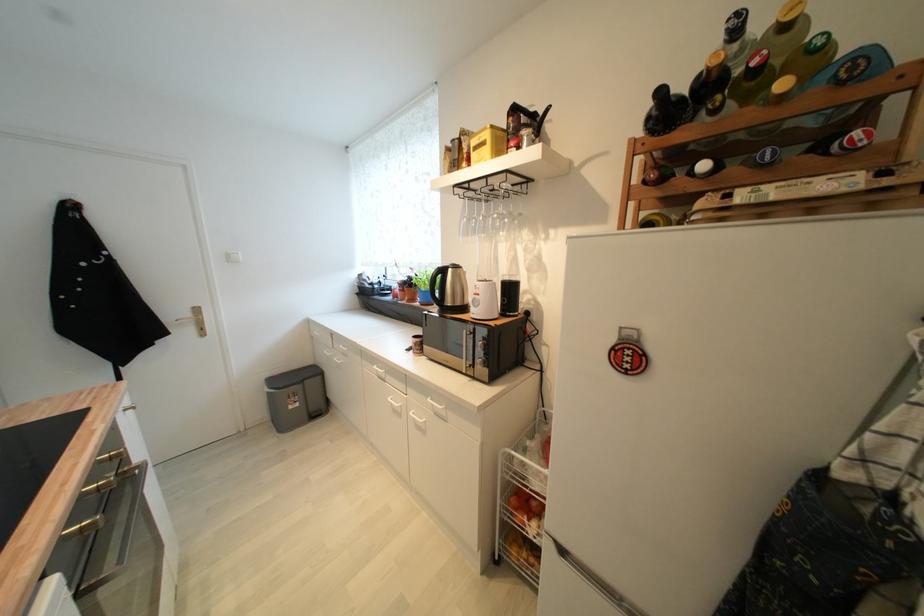
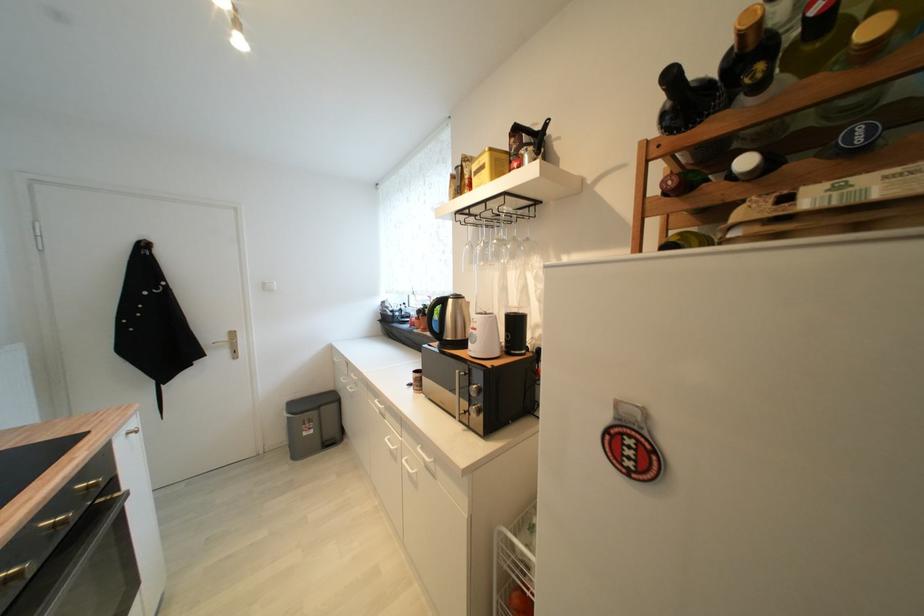
Where in the second image is the point corresponding to point 416,280 from the first image?

(431, 309)